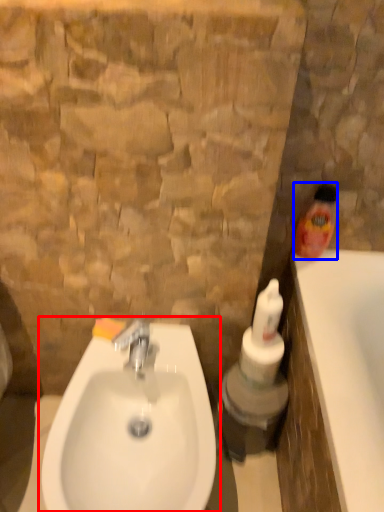
Question: Which point is closer to the camera, sink (highlighted by a red box) or cleaning product (highlighted by a blue box)?

Choices:
 (A) sink
 (B) cleaning product

Answer: (A)